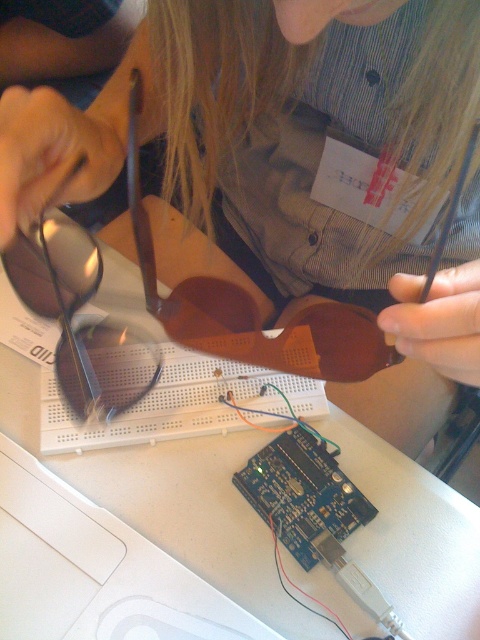
You are a technician trying to determine which object is taller between the matte brown sunglasses at center and the matte brown goggles at upper left. Based on the scene description, which one is taller?

The matte brown sunglasses at center is much taller than the matte brown goggles at upper left according to the description.

You are a technician who needs to retrieve the matte brown goggles at upper left to protect your eyes while soldering. However, the matte brown sunglasses at center is blocking the way. Can you move the sunglasses to access the goggles?

The matte brown sunglasses at center is located above the matte brown goggles at upper left, so you can move the sunglasses downward to access the goggles below.

You are an engineer inspecting the electronic setup. You need to locate the matte brown sunglasses at center and the matte brown goggles at upper left. Which object is positioned to the right side of the other?

The matte brown sunglasses at center is to the right of the matte brown goggles at upper left.